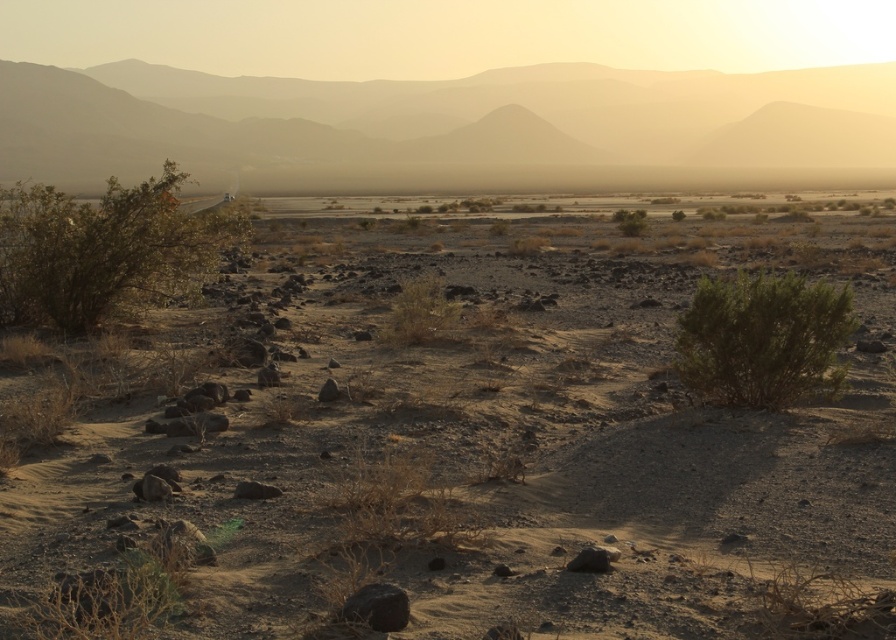
Question: Considering the relative positions of green shrub at left and green leafy bush at center in the image provided, where is green shrub at left located with respect to green leafy bush at center?

Choices:
 (A) above
 (B) below

Answer: (A)

Question: Which of the following is the farthest from the observer?

Choices:
 (A) dull brown dirt at center
 (B) green shrub at left
 (C) green leafy bush at center right
 (D) green leafy bush at center

Answer: (D)

Question: Is the position of sandy brown mountain at upper center more distant than that of green leafy bush at center?

Choices:
 (A) yes
 (B) no

Answer: (A)

Question: Among these objects, which one is farthest from the camera?

Choices:
 (A) green leafy bush at center right
 (B) green leafy bush at center
 (C) dull brown dirt at center
 (D) green shrub at left

Answer: (B)

Question: Which point appears closest to the camera in this image?

Choices:
 (A) (640, 209)
 (B) (690, 330)
 (C) (147, 248)

Answer: (B)

Question: Does sandy brown mountain at upper center have a greater width compared to green leafy bush at center right?

Choices:
 (A) yes
 (B) no

Answer: (A)